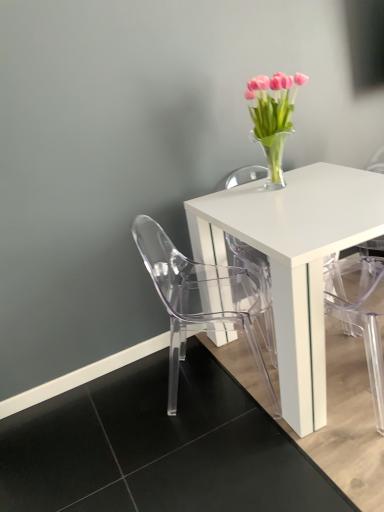
Question: Does pink glass vase at upper right appear on the right side of transparent plastic armchair at lower right?

Choices:
 (A) no
 (B) yes

Answer: (A)

Question: Would you say transparent plastic armchair at lower right is part of pink glass vase at upper right's contents?

Choices:
 (A) no
 (B) yes

Answer: (A)

Question: From a real-world perspective, does pink glass vase at upper right stand above transparent plastic armchair at lower right?

Choices:
 (A) no
 (B) yes

Answer: (B)

Question: Is pink glass vase at upper right bigger than transparent plastic armchair at lower right?

Choices:
 (A) no
 (B) yes

Answer: (A)

Question: Considering the relative sizes of pink glass vase at upper right and transparent plastic armchair at lower right in the image provided, is pink glass vase at upper right smaller than transparent plastic armchair at lower right?

Choices:
 (A) yes
 (B) no

Answer: (A)

Question: Can you confirm if pink glass vase at upper right is positioned to the left of transparent plastic armchair at lower right?

Choices:
 (A) yes
 (B) no

Answer: (A)

Question: Is white glossy table at center next to transparent plastic chair at lower left?

Choices:
 (A) no
 (B) yes

Answer: (A)

Question: Is white glossy table at center looking in the opposite direction of transparent plastic chair at lower left?

Choices:
 (A) no
 (B) yes

Answer: (A)

Question: Is white glossy table at center positioned far away from transparent plastic chair at lower left?

Choices:
 (A) yes
 (B) no

Answer: (B)

Question: Would you say transparent plastic chair at lower left is part of white glossy table at center's contents?

Choices:
 (A) no
 (B) yes

Answer: (A)

Question: Does white glossy table at center have a lesser height compared to transparent plastic chair at lower left?

Choices:
 (A) no
 (B) yes

Answer: (B)

Question: Is white glossy table at center thinner than transparent plastic chair at lower left?

Choices:
 (A) yes
 (B) no

Answer: (B)

Question: Can you confirm if pink glass vase at upper right is thinner than transparent plastic chair at lower left?

Choices:
 (A) yes
 (B) no

Answer: (A)